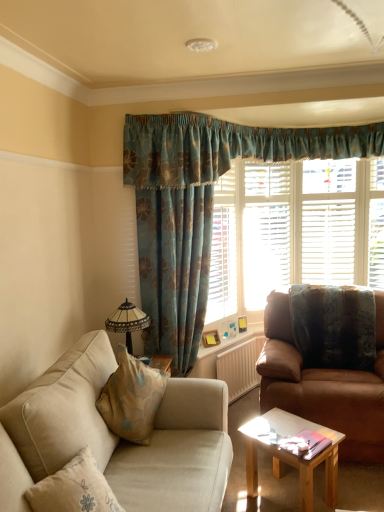
The image size is (384, 512). Describe the element at coordinates (265, 232) in the screenshot. I see `white wooden shutters at center` at that location.

The image size is (384, 512). What do you see at coordinates (292, 455) in the screenshot? I see `light brown wooden coffee table at center` at bounding box center [292, 455].

I want to click on light brown wooden coffee table at center, so click(292, 455).

Describe the element at coordinates (240, 367) in the screenshot. The width and height of the screenshot is (384, 512). I see `white textured radiator at center` at that location.

Describe the element at coordinates (117, 437) in the screenshot. I see `beige fabric couch at lower left, which is the first studio couch in front-to-back order` at that location.

This screenshot has width=384, height=512. In order to click on white wooden shutters at center in this screenshot , I will do `click(265, 232)`.

Who is taller, light brown wooden coffee table at center or brown leather couch at right, the 2th studio couch positioned from the front?

Standing taller between the two is brown leather couch at right, the 2th studio couch positioned from the front.

Is light brown wooden coffee table at center oriented towards brown leather couch at right, arranged as the 1th studio couch when viewed from the back?

No, light brown wooden coffee table at center is not oriented towards brown leather couch at right, arranged as the 1th studio couch when viewed from the back.

From a real-world perspective, is light brown wooden coffee table at center positioned under brown leather couch at right, arranged as the 1th studio couch when viewed from the back, based on gravity?

Correct, in the physical world, light brown wooden coffee table at center is lower than brown leather couch at right, arranged as the 1th studio couch when viewed from the back.

Does light brown wooden coffee table at center have a greater width compared to brown leather couch at right, the 2th studio couch positioned from the front?

No, light brown wooden coffee table at center is not wider than brown leather couch at right, the 2th studio couch positioned from the front.

Who is shorter, stained glass lampshade at left or beige fabric couch at lower left, which is counted as the first studio couch, starting from the left?

With less height is stained glass lampshade at left.

Can you confirm if stained glass lampshade at left is wider than beige fabric couch at lower left, which is counted as the first studio couch, starting from the left?

In fact, stained glass lampshade at left might be narrower than beige fabric couch at lower left, which is counted as the first studio couch, starting from the left.

From the image's perspective, would you say stained glass lampshade at left is positioned over beige fabric couch at lower left, which is counted as the first studio couch, starting from the left?

Yes, from the image's perspective, stained glass lampshade at left is above beige fabric couch at lower left, which is counted as the first studio couch, starting from the left.

Is the surface of stained glass lampshade at left in direct contact with beige fabric couch at lower left, which is counted as the first studio couch, starting from the left?

No, stained glass lampshade at left is not with beige fabric couch at lower left, which is counted as the first studio couch, starting from the left.

Between beige fabric couch at lower left, the 2th studio couch positioned from the right, and white wooden shutters at center, which one has smaller width?

Thinner between the two is white wooden shutters at center.

In the scene shown: Is beige fabric couch at lower left, the 2th studio couch positioned from the right, positioned in front of white wooden shutters at center?

Yes, beige fabric couch at lower left, the 2th studio couch positioned from the right, is in front of white wooden shutters at center.

Could you tell me if beige fabric couch at lower left, the 2th studio couch positioned from the right, is turned towards white wooden shutters at center?

No.

Measure the distance from beige fabric couch at lower left, which is the first studio couch in front-to-back order, to white wooden shutters at center.

A distance of 6.91 feet exists between beige fabric couch at lower left, which is the first studio couch in front-to-back order, and white wooden shutters at center.

Locate an element on the screen. The height and width of the screenshot is (512, 384). lamp that is on the left side of textured brown pillow at right is located at coordinates (127, 321).

From the image's perspective, does stained glass lampshade at left appear lower than textured brown pillow at right?

Yes, from the image's perspective, stained glass lampshade at left is beneath textured brown pillow at right.

Is stained glass lampshade at left turned away from textured brown pillow at right?

stained glass lampshade at left is not turned away from textured brown pillow at right.

Would you say stained glass lampshade at left is outside textured brown pillow at right?

Yes.

What's the angular difference between textured brown pillow at right and white textured radiator at center's facing directions?

There is a 63.5-degree angle between the facing directions of textured brown pillow at right and white textured radiator at center.

From the picture: Considering the relative sizes of textured brown pillow at right and white textured radiator at center in the image provided, is textured brown pillow at right smaller than white textured radiator at center?

Incorrect, textured brown pillow at right is not smaller in size than white textured radiator at center.

Could you tell me if textured brown pillow at right is turned towards white textured radiator at center?

No, textured brown pillow at right is not facing towards white textured radiator at center.

Is textured brown pillow at right a part of brown leather couch at right, the 2th studio couch positioned from the front?

Yes, brown leather couch at right, the 2th studio couch positioned from the front, contains textured brown pillow at right.

Which object is thinner, brown leather couch at right, arranged as the 1th studio couch when viewed from the right, or textured brown pillow at right?

Thinner between the two is textured brown pillow at right.

Considering the points (337, 391) and (327, 359), which point is behind, point (337, 391) or point (327, 359)?

The point (327, 359) is behind.

Which object is positioned more to the right, brown leather couch at right, arranged as the 1th studio couch when viewed from the right, or textured brown pillow at right?

textured brown pillow at right.

Is there a large distance between textured brown pillow at right and beige fabric couch at lower left, which is the first studio couch in front-to-back order?

That's right, there is a large distance between textured brown pillow at right and beige fabric couch at lower left, which is the first studio couch in front-to-back order.

Between textured brown pillow at right and beige fabric couch at lower left, which ranks as the second studio couch in back-to-front order, which one is positioned in front?

beige fabric couch at lower left, which ranks as the second studio couch in back-to-front order, is closer to the camera.

How many degrees apart are the facing directions of textured brown pillow at right and beige fabric couch at lower left, which ranks as the second studio couch in back-to-front order?

There is a 91.4-degree angle between the facing directions of textured brown pillow at right and beige fabric couch at lower left, which ranks as the second studio couch in back-to-front order.

Does textured brown pillow at right appear on the left side of beige fabric couch at lower left, the 2th studio couch positioned from the right?

In fact, textured brown pillow at right is to the right of beige fabric couch at lower left, the 2th studio couch positioned from the right.

Where is `coffee table below the brown leather couch at right, arranged as the 1th studio couch when viewed from the back (from the image's perspective)`? This screenshot has height=512, width=384. coffee table below the brown leather couch at right, arranged as the 1th studio couch when viewed from the back (from the image's perspective) is located at coordinates (292, 455).

Identify the location of lamp on the left of beige fabric couch at lower left, which is the first studio couch in front-to-back order. (127, 321).

Looking at the image, which one is located closer to textured brown pillow at right, light brown wooden coffee table at center or stained glass lampshade at left?

light brown wooden coffee table at center is closer to textured brown pillow at right.

Considering their positions, is white textured radiator at center positioned further to stained glass lampshade at left than light brown wooden coffee table at center?

light brown wooden coffee table at center.

Based on their spatial positions, is textured brown pillow at right or stained glass lampshade at left closer to white textured radiator at center?

textured brown pillow at right lies closer to white textured radiator at center than the other object.

Which object lies nearer to the anchor point light brown wooden coffee table at center, stained glass lampshade at left or beige fabric couch at lower left, the 2th studio couch positioned from the right?

Among the two, beige fabric couch at lower left, the 2th studio couch positioned from the right, is located nearer to light brown wooden coffee table at center.

When comparing their distances from white textured radiator at center, does textured brown pillow at right or light brown wooden coffee table at center seem further?

light brown wooden coffee table at center.

When comparing their distances from stained glass lampshade at left, does textured brown pillow at right or brown leather couch at right, the second studio couch from the left, seem closer?

Among the two, brown leather couch at right, the second studio couch from the left, is located nearer to stained glass lampshade at left.

When comparing their distances from textured brown pillow at right, does light brown wooden coffee table at center or beige fabric couch at lower left, the 2th studio couch positioned from the right, seem further?

beige fabric couch at lower left, the 2th studio couch positioned from the right, is positioned further to the anchor textured brown pillow at right.

Based on their spatial positions, is textured brown pillow at right or stained glass lampshade at left closer to white wooden shutters at center?

textured brown pillow at right.

This screenshot has width=384, height=512. Identify the location of pillow located between beige fabric couch at lower left, which is the first studio couch in front-to-back order, and white textured radiator at center in the depth direction. (334, 326).

Where is `pillow located between brown leather couch at right, arranged as the 1th studio couch when viewed from the back, and white textured radiator at center in the depth direction`? This screenshot has height=512, width=384. pillow located between brown leather couch at right, arranged as the 1th studio couch when viewed from the back, and white textured radiator at center in the depth direction is located at coordinates (334, 326).

At what (x,y) coordinates should I click in order to perform the action: click on shutter between stained glass lampshade at left and brown leather couch at right, the second studio couch from the left, in the horizontal direction. Please return your answer as a coordinate pair (x, y). The image size is (384, 512). Looking at the image, I should click on (265, 232).

I want to click on lamp positioned between beige fabric couch at lower left, which ranks as the second studio couch in back-to-front order, and textured brown pillow at right from near to far, so click(x=127, y=321).